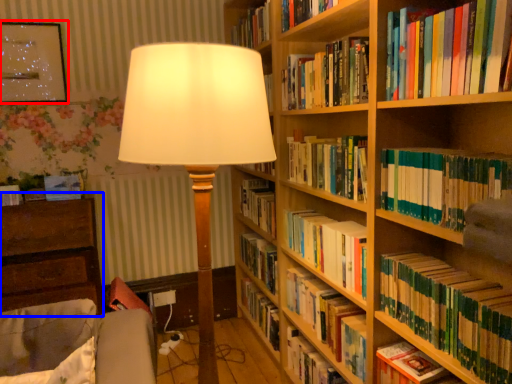
Question: Among these objects, which one is nearest to the camera, picture frame (highlighted by a red box) or chest of drawers (highlighted by a blue box)?

Choices:
 (A) picture frame
 (B) chest of drawers

Answer: (B)